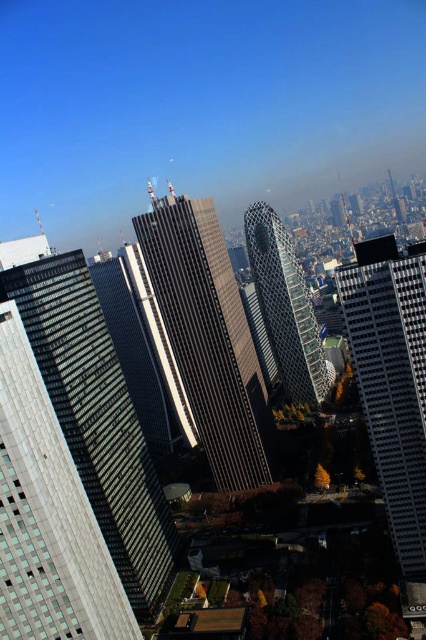
You are a drone operator tasked with capturing aerial footage of the city. Your drone has a maximum flight range of 500 feet. If you are standing at the camera position, can your drone reach the metallic glass skyscraper at center?

The distance between the metallic glass skyscraper at center and the camera is 484.41 feet, which is within the drone operator maximum flight range of 500 feet. So yes, the drone can reach the metallic glass skyscraper at center.

You are standing at the camera position looking at the city. You want to take a photo of the silver glass skyscraper at center. Is it possible to capture the entire building in your smartphone camera without moving the phone?

The silver glass skyscraper at center is 136.65 meters away from camera. Since smartphones have wide angle lenses, it is possible to capture the entire building in the photo without moving the phone.

You are standing in the city and want to know how far the point at coordinates (405, 502) is from you. Can you determine the distance?

The point at coordinates (405, 502) is 595.52 feet away from the viewer.